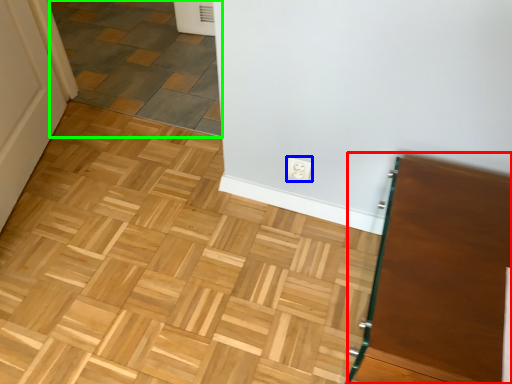
Question: Considering the real-world distances, which object is closest to vanity (highlighted by a red box)? electric outlet (highlighted by a blue box) or tile (highlighted by a green box).

Choices:
 (A) electric outlet
 (B) tile

Answer: (A)